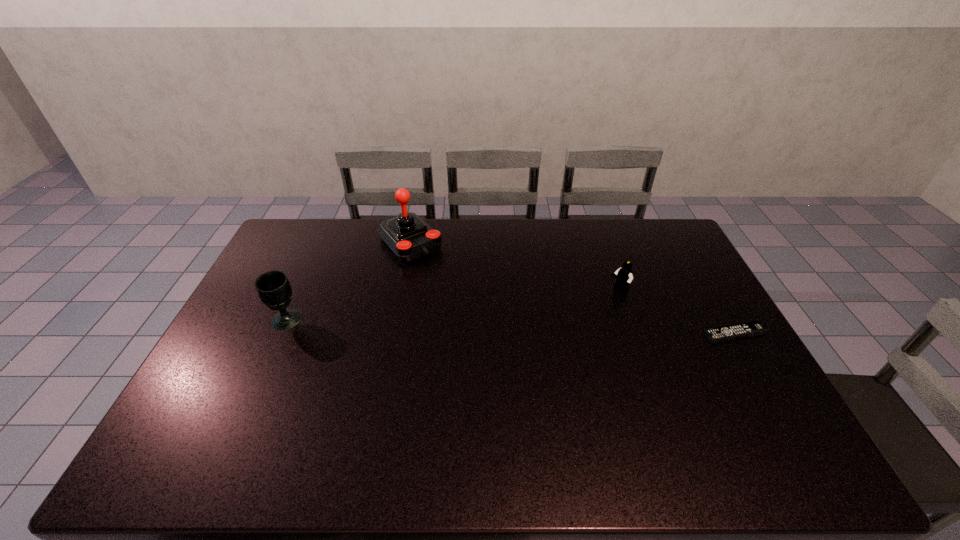
Where is `free space between the joystick and the remote control`? Image resolution: width=960 pixels, height=540 pixels. free space between the joystick and the remote control is located at coordinates (572, 288).

At what (x,y) coordinates should I click in order to perform the action: click on unoccupied area between the shortest object and the second farthest object. Please return your answer as a coordinate pair (x, y). This screenshot has width=960, height=540. Looking at the image, I should click on (677, 312).

I want to click on empty space between the chalice and the second object from left to right, so click(348, 281).

Where is `the third closest object to the second farthest object`? This screenshot has width=960, height=540. the third closest object to the second farthest object is located at coordinates (273, 287).

Select which object is the second closest to the remote control. Please provide its 2D coordinates. Your answer should be formatted as a tuple, i.e. [(x, y)], where the tuple contains the x and y coordinates of a point satisfying the conditions above.

[(407, 235)]

Find the location of `free point that satisfies the following two spatial constraints: 1. on the back side of the farthest object; 2. on the left side of the leftmost object`. free point that satisfies the following two spatial constraints: 1. on the back side of the farthest object; 2. on the left side of the leftmost object is located at coordinates (322, 242).

This screenshot has height=540, width=960. What are the coordinates of `free space that satisfies the following two spatial constraints: 1. on the front side of the second shortest object; 2. on the right side of the tallest object` in the screenshot? It's located at (400, 290).